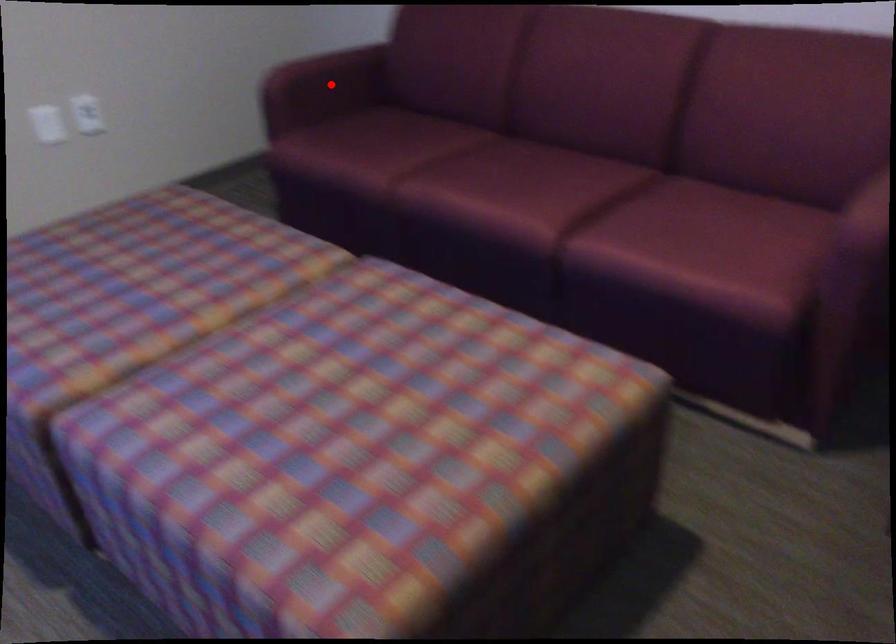
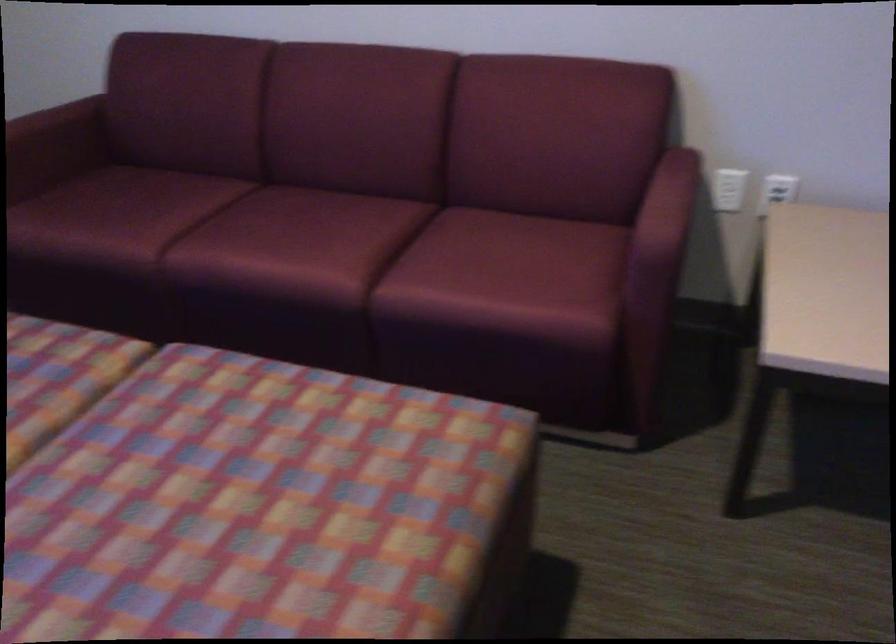
Question: I am providing you with two images of the same scene from different viewpoints. Given a red point in image1, look at the same physical point in image2. Is it:

Choices:
 (A) Closer to the viewpoint
 (B) Farther from the viewpoint

Answer: (A)